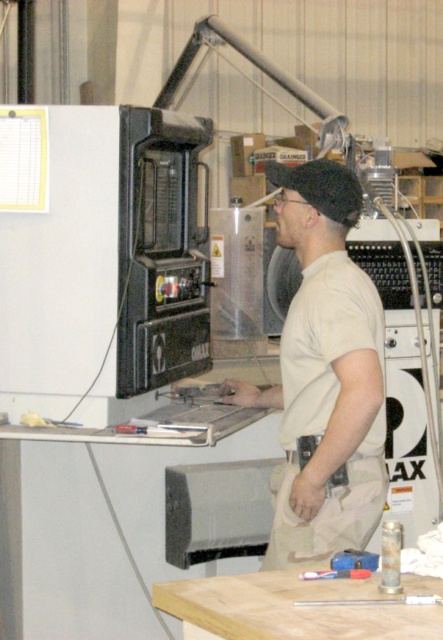
Consider the image. You are a technician in the workshop. You need to place a new tool on the light brown wood at lower center. However, there is a brushed metal screwdriver at center in the way. To make space, which object should you move, and in which direction relative to the other?

The brushed metal screwdriver at center is to the right of the light brown wood at lower center. To make space, you should move the brushed metal screwdriver at center to the right away from the light brown wood at lower center.

You are standing in the workshop and want to reach both points. Which point, point (x=353, y=188) or point (x=342, y=557), will you reach first if you move straight towards them?

Point (x=353, y=188) is further to the camera than point (x=342, y=557), so you will reach point (x=342, y=557) first because it is closer to you.

From the picture: You are standing in the workshop and need to place a small tool on the light brown wood at lower center. According to the coordinates provided, where exactly should you place it?

The light brown wood at lower center is located at point (288, 609), so you should place the tool at those coordinates.